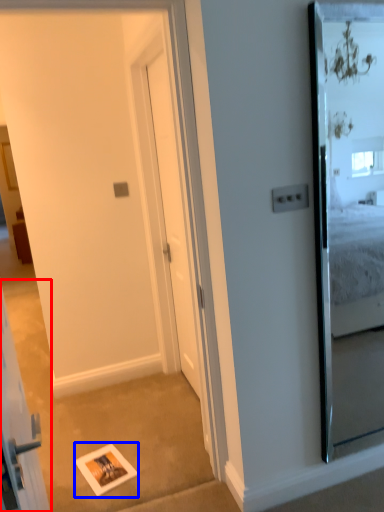
Question: Which point is further to the camera, elevator (highlighted by a red box) or picture frame (highlighted by a blue box)?

Choices:
 (A) elevator
 (B) picture frame

Answer: (B)